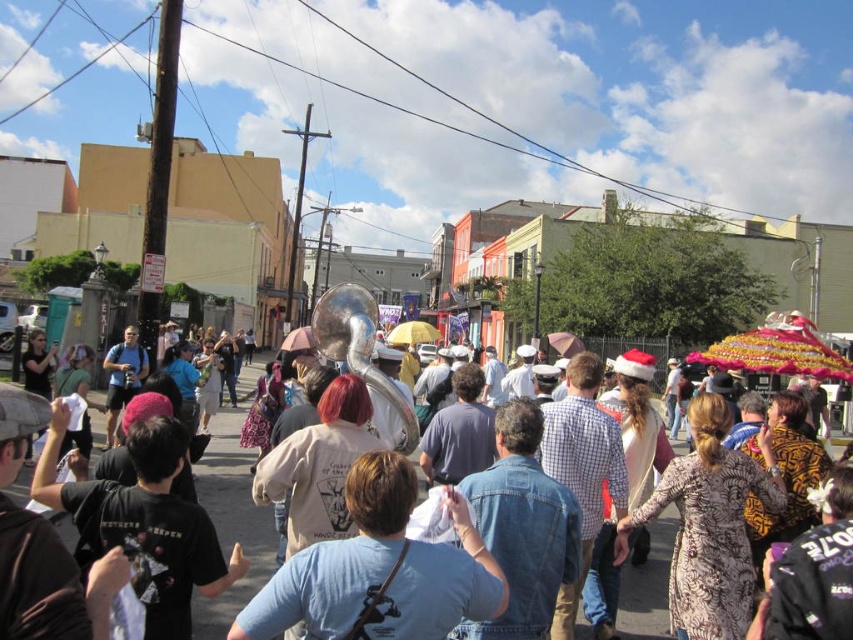
You are a photographer trying to capture a clear shot of the blue denim shirt at center and the denim jacket at center. Since the crowd is thick, you need to know which item of clothing is narrower to focus your lens. Which one is thinner?

The blue denim shirt at center is thinner than the denim jacket at center, so you should focus on the blue denim shirt at center for a clearer shot.